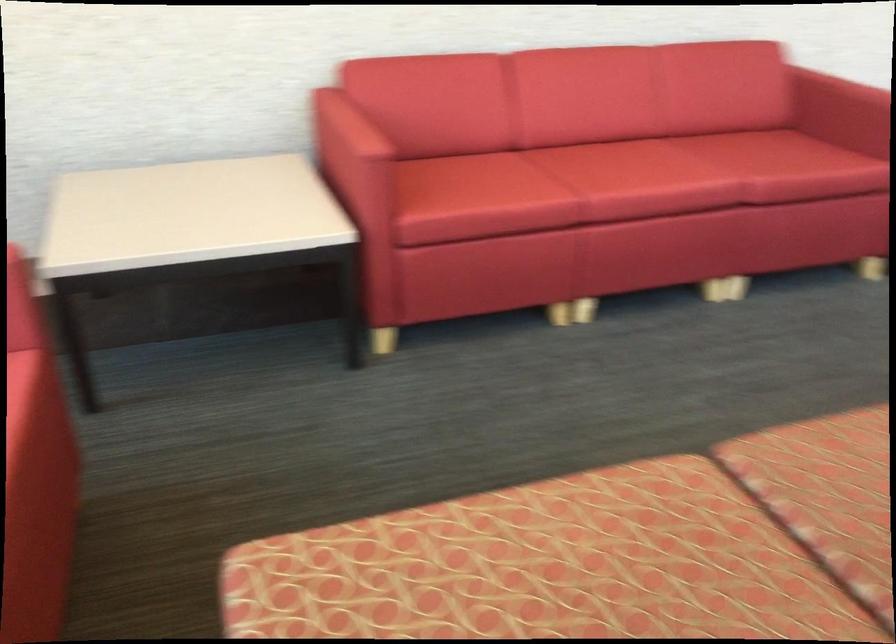
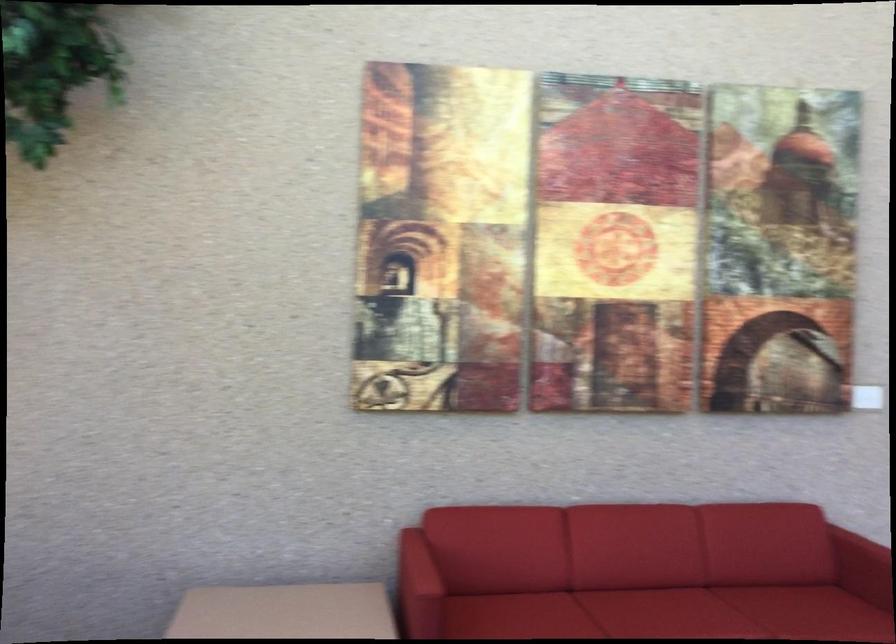
In the second image, find the point that corresponds to pixel 621 158 in the first image.

(659, 607)